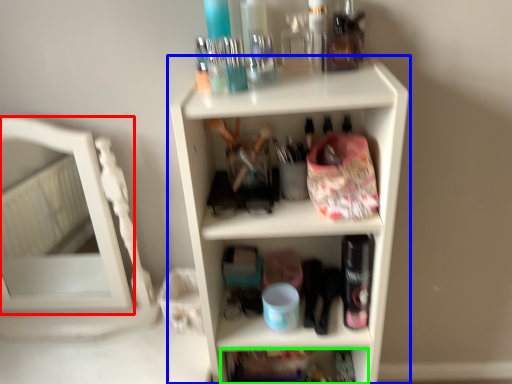
Question: Estimate the real-world distances between objects in this image. Which object is farther from mirror (highlighted by a red box), shelf (highlighted by a blue box) or shelf (highlighted by a green box)?

Choices:
 (A) shelf
 (B) shelf

Answer: (B)